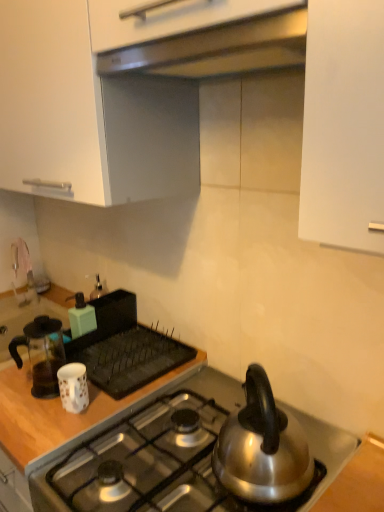
Where is `free space in front of matte green soap dispenser at upper left, which ranks as the 1th kitchen appliance in back-to-front order`? This screenshot has width=384, height=512. free space in front of matte green soap dispenser at upper left, which ranks as the 1th kitchen appliance in back-to-front order is located at coordinates (89, 360).